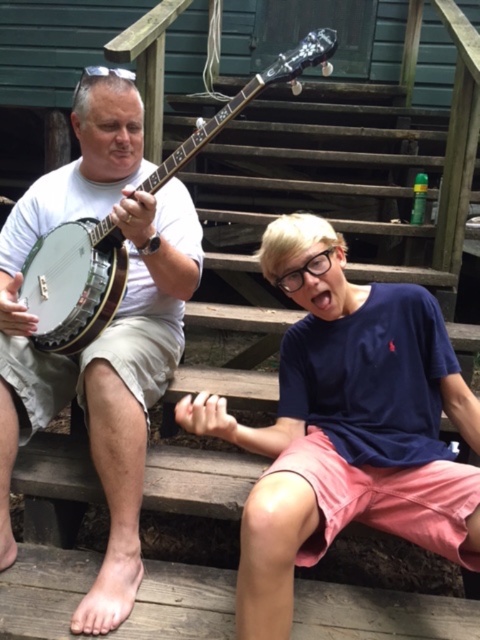
Question: Is blue cotton shirt at center bigger than white wooden banjo at upper center?

Choices:
 (A) no
 (B) yes

Answer: (B)

Question: Is blue cotton shirt at center to the right of white wooden banjo at upper center from the viewer's perspective?

Choices:
 (A) yes
 (B) no

Answer: (A)

Question: Which point is closer to the camera?

Choices:
 (A) (86, 342)
 (B) (141, 112)

Answer: (A)

Question: Which of the following is the closest to the observer?

Choices:
 (A) matte white banjo at left
 (B) white wooden banjo at upper center
 (C) blue cotton shirt at center

Answer: (C)

Question: Which point is closer to the camera?

Choices:
 (A) blue cotton shirt at center
 (B) matte white banjo at left
 (C) white wooden banjo at upper center

Answer: (A)

Question: Is blue cotton shirt at center to the left of white wooden banjo at upper center from the viewer's perspective?

Choices:
 (A) no
 (B) yes

Answer: (A)